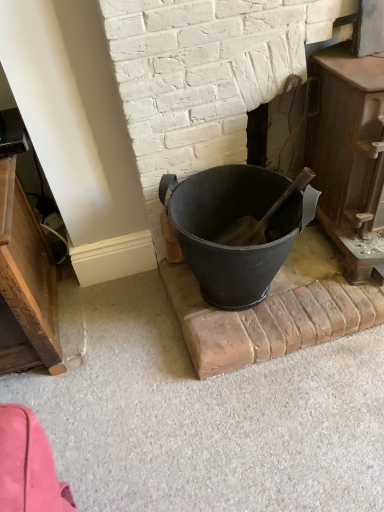
Find the location of a particular element. This screenshot has width=384, height=512. vacant area situated below matte black bucket at center (from a real-world perspective) is located at coordinates (261, 298).